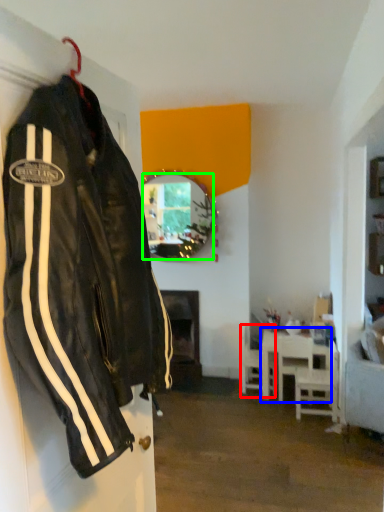
Question: Based on their relative distances, which object is farther from chair (highlighted by a red box)? Choose from table (highlighted by a blue box) and mirror (highlighted by a green box).

Choices:
 (A) table
 (B) mirror

Answer: (B)